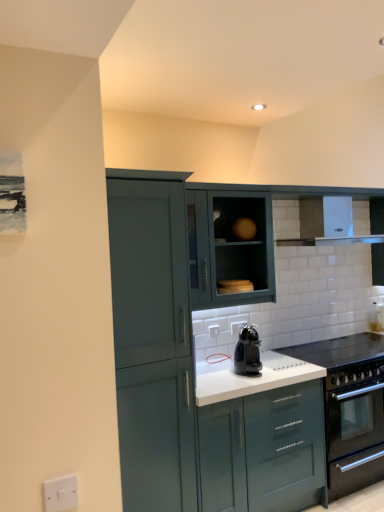
At what (x,y) coordinates should I click in order to perform the action: click on free space to the right of black plastic coffee machine at center. Please return your answer as a coordinate pair (x, y). The width and height of the screenshot is (384, 512). Looking at the image, I should click on (287, 371).